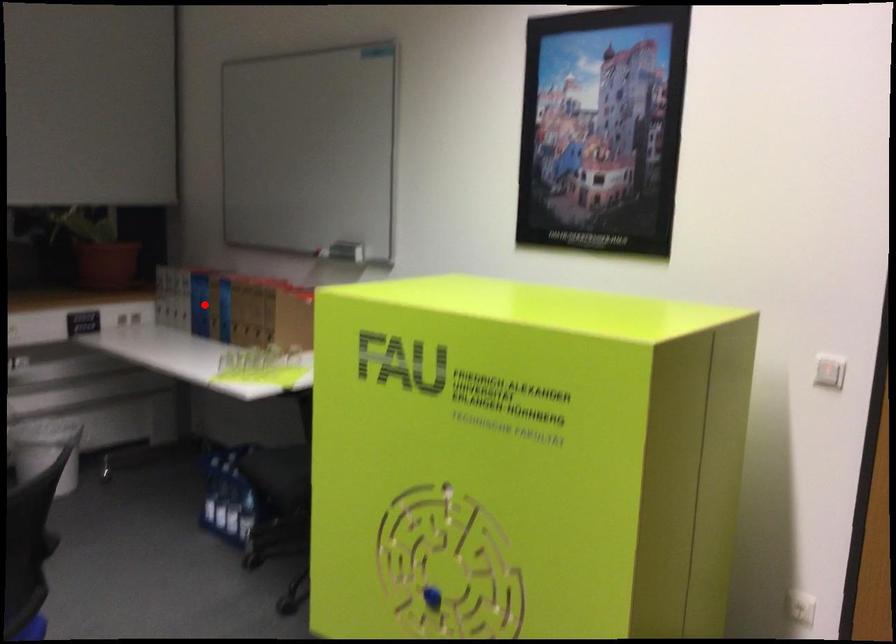
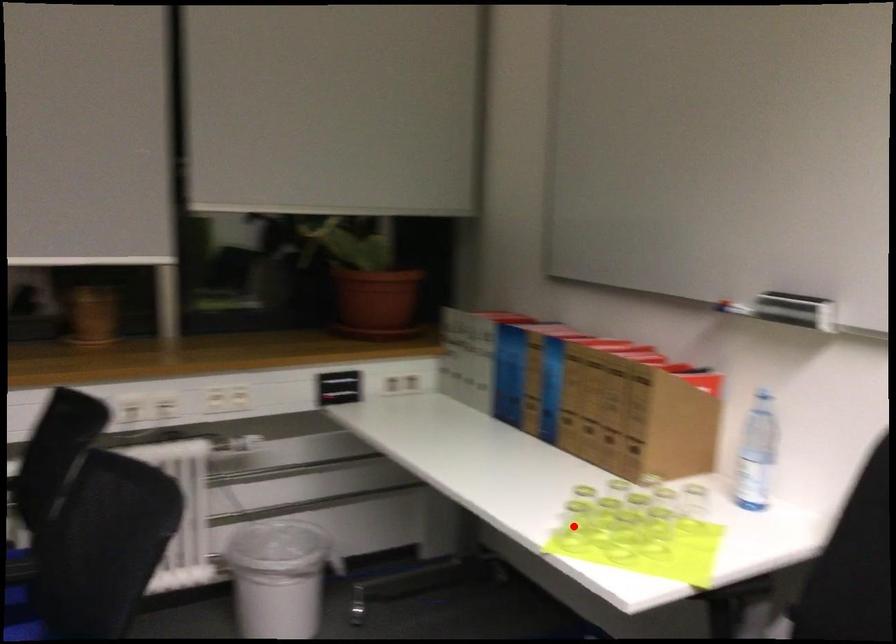
I am providing you with two images of the same scene from different viewpoints. A red point is marked on the first image and another point is marked on the second image. Are the points marked in image1 and image2 representing the same 3D position?

No